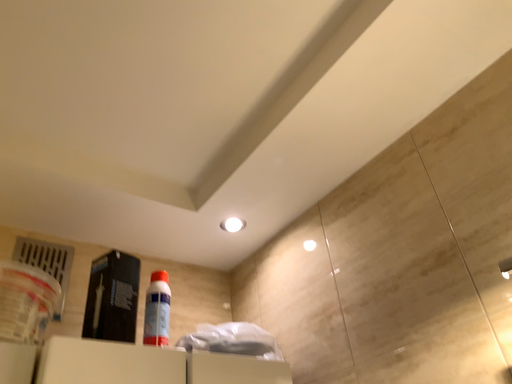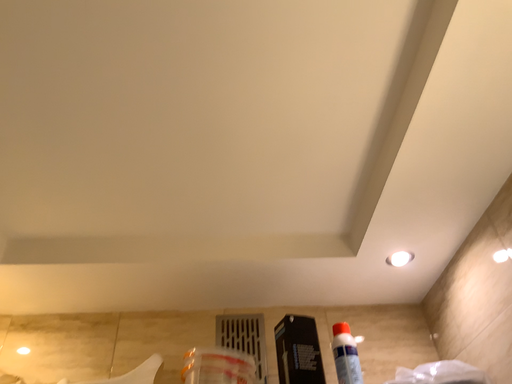
Question: Which way did the camera rotate in the video?

Choices:
 (A) rotated left
 (B) rotated right

Answer: (A)